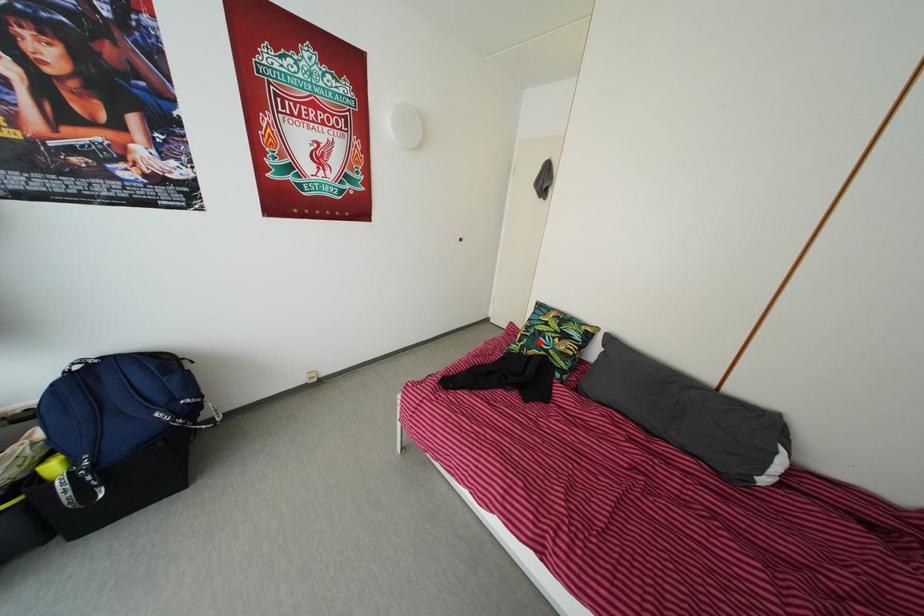
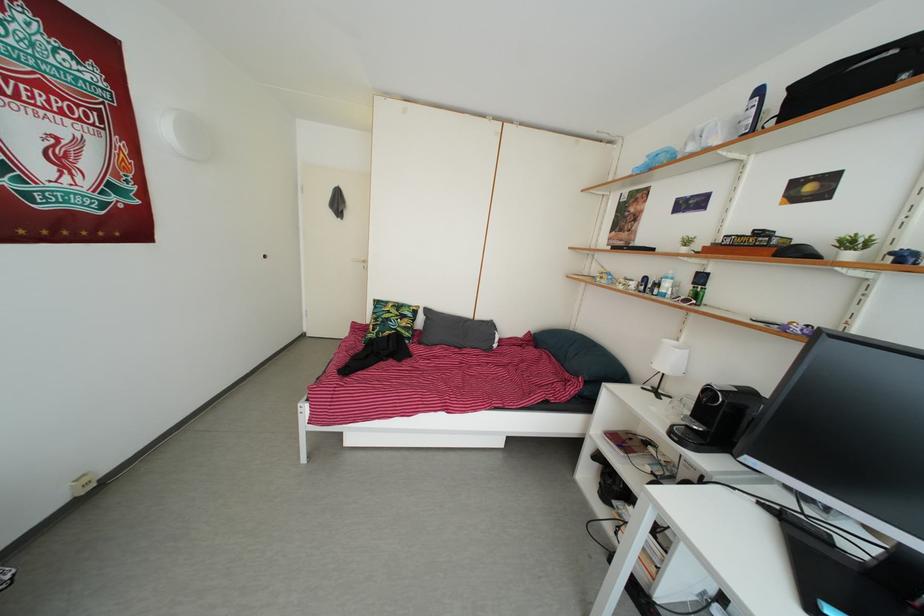
Where in the second image is the point corresponding to the highlighted location from the first image?

(388, 330)